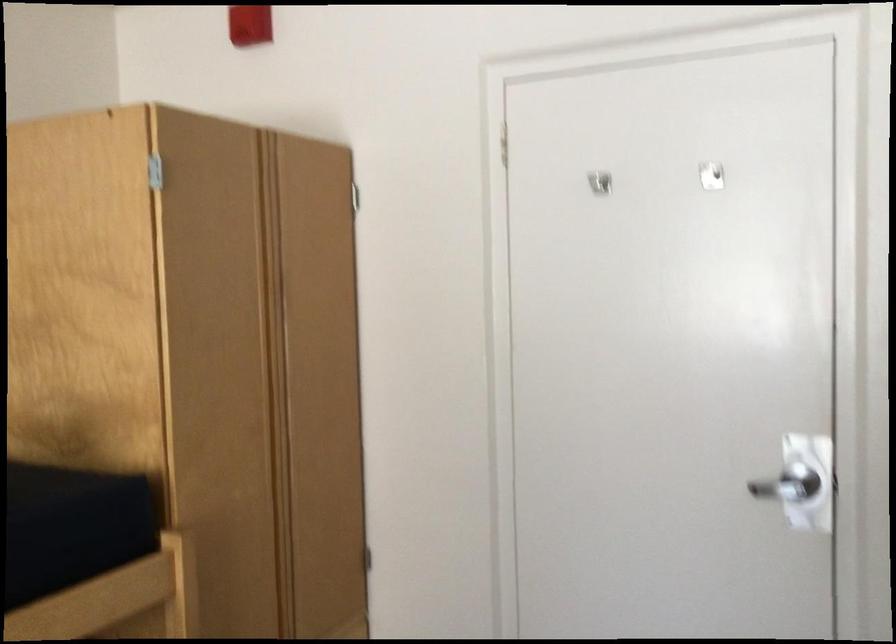
Find where to slid the peephole cover. Please return your answer as a coordinate pair (x, y).

(711, 176)